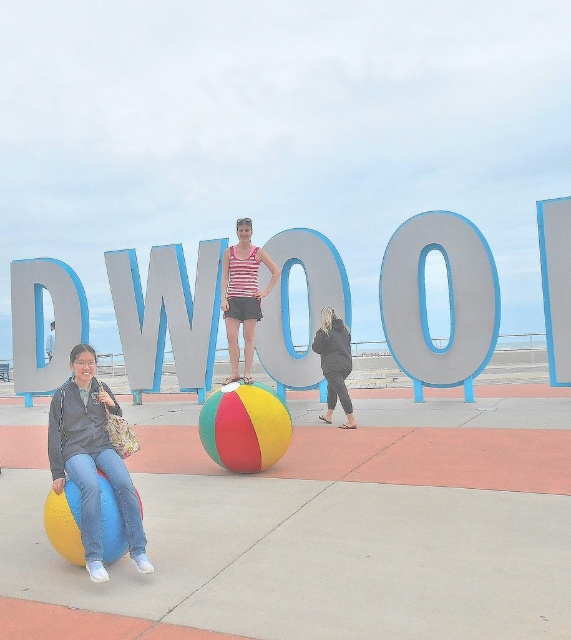
Question: Considering the relative positions of matte gray letter o at center and striped fabric tank top at center in the image provided, where is matte gray letter o at center located with respect to striped fabric tank top at center?

Choices:
 (A) below
 (B) above

Answer: (A)

Question: Considering the relative positions of matte plastic letter w at center and striped fabric tank top at center in the image provided, where is matte plastic letter w at center located with respect to striped fabric tank top at center?

Choices:
 (A) right
 (B) left

Answer: (B)

Question: Is the position of matte gray letter o at center less distant than that of black fleece jacket at center?

Choices:
 (A) yes
 (B) no

Answer: (B)

Question: Which object is positioned closest to the matte gray letter w at center?

Choices:
 (A) blue plastic letter at upper right
 (B) matte yellow ball at lower left

Answer: (A)

Question: Which of the following is the farthest from the observer?

Choices:
 (A) (304, 234)
 (B) (150, 572)

Answer: (A)

Question: Among these objects, which one is nearest to the camera?

Choices:
 (A) striped fabric tank top at center
 (B) brushed metal letter d at upper left
 (C) multicolored rubber beach ball at lower left

Answer: (C)